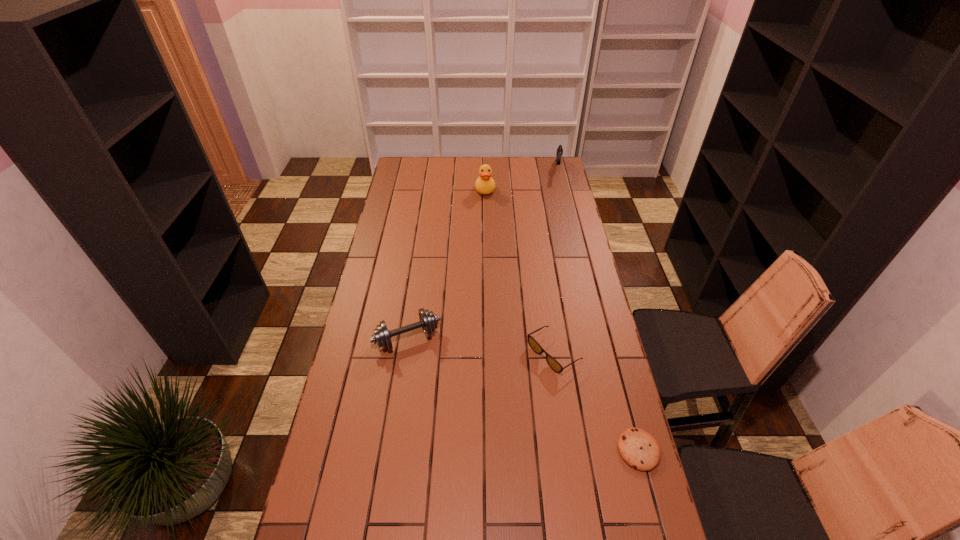
Where is `vacant position at the near left corner of the desktop`? vacant position at the near left corner of the desktop is located at coordinates (358, 522).

This screenshot has width=960, height=540. In the image, there is a desktop. In order to click on vacant space at the far right corner in this screenshot , I will do `click(540, 172)`.

Identify the location of vacant area that lies between the duck and the gun. (521, 179).

Where is `free space between the gun and the nearest object`? The height and width of the screenshot is (540, 960). free space between the gun and the nearest object is located at coordinates (598, 309).

Where is `unoccupied position between the fourth tallest object and the gun`? unoccupied position between the fourth tallest object and the gun is located at coordinates (556, 261).

The width and height of the screenshot is (960, 540). What are the coordinates of `free space between the dumbbell and the sunglasses` in the screenshot? It's located at (481, 346).

This screenshot has height=540, width=960. Identify the location of vacant space that's between the tallest object and the dumbbell. (446, 264).

You are a GUI agent. You are given a task and a screenshot of the screen. Output one action in this format:
    pyautogui.click(x=<x>, y=<y>)
    Task: Click on the vacant area between the sunglasses and the gun
    This screenshot has height=540, width=960.
    Given the screenshot: What is the action you would take?
    pyautogui.click(x=556, y=261)

Identify the location of vacant area that lies between the dumbbell and the farthest object. This screenshot has height=540, width=960. (483, 254).

Locate an element on the screen. The image size is (960, 540). free spot between the farthest object and the third object from left to right is located at coordinates (556, 261).